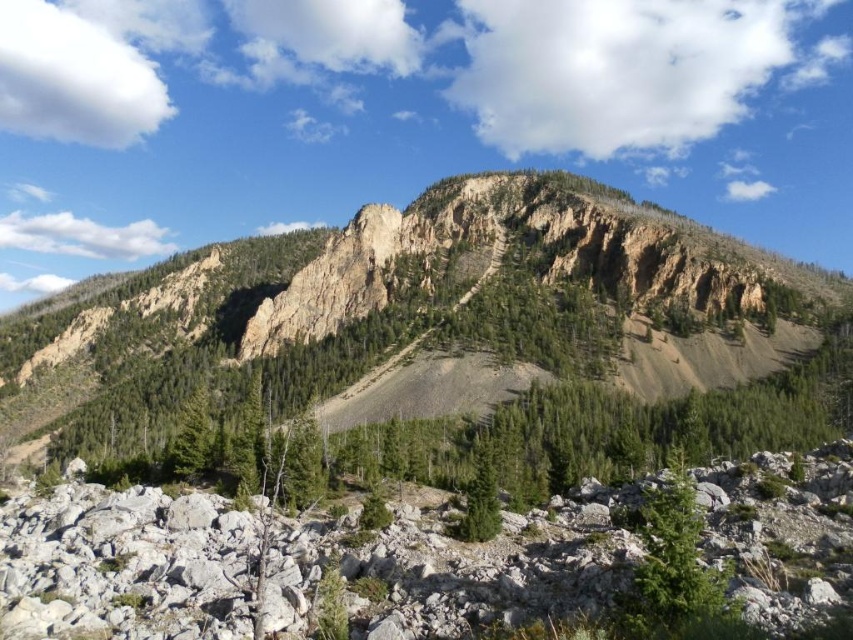
You are standing at the origin point in the image. Which direction should you move to reach the green matte tree at lower right?

The green matte tree at lower right is located at coordinates approximately 0.889 on the x axis and 0.789 on the y axis. Since you are at the origin, you should move towards the positive x and positive y direction to reach it.